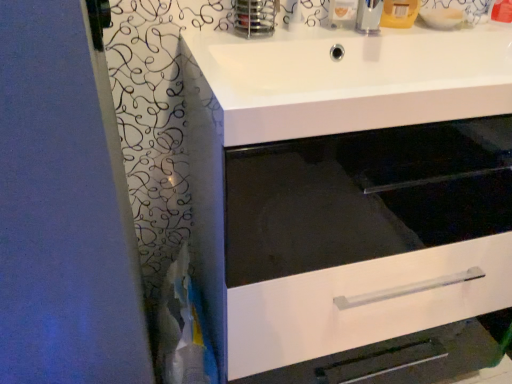
Where is `white glossy sink at upper center`? Image resolution: width=512 pixels, height=384 pixels. white glossy sink at upper center is located at coordinates (347, 79).

This screenshot has height=384, width=512. What do you see at coordinates (347, 79) in the screenshot?
I see `white glossy sink at upper center` at bounding box center [347, 79].

Describe the element at coordinates (351, 200) in the screenshot. The width and height of the screenshot is (512, 384). I see `white glossy drawer at center` at that location.

What is the approximate height of white glossy drawer at center?

white glossy drawer at center is 90.03 centimeters in height.

In the scene shown: In order to face white glossy drawer at center, should I rotate leftwards or rightwards?

To align with it, rotate right about 14.809°.

Locate an element on the screen. The image size is (512, 384). white glossy drawer at center is located at coordinates (351, 200).

Image resolution: width=512 pixels, height=384 pixels. I want to click on white glossy sink at upper center, so pos(347,79).

Looking at this image, based on their positions, is white glossy sink at upper center located to the left or right of white glossy drawer at center?

From the image, it's evident that white glossy sink at upper center is to the right of white glossy drawer at center.

Is white glossy sink at upper center positioned in front of white glossy drawer at center?

That is True.

Does point (201, 74) lie behind point (488, 311)?

No, (201, 74) is in front of (488, 311).

From the image's perspective, who appears lower, white glossy sink at upper center or white glossy drawer at center?

white glossy drawer at center.

From a real-world perspective, is white glossy sink at upper center beneath white glossy drawer at center?

Incorrect, from a real-world perspective, white glossy sink at upper center is higher than white glossy drawer at center.

In terms of width, does white glossy sink at upper center look wider or thinner when compared to white glossy drawer at center?

In the image, white glossy sink at upper center appears to be wider than white glossy drawer at center.

Considering the sizes of white glossy sink at upper center and white glossy drawer at center in the image, is white glossy sink at upper center taller or shorter than white glossy drawer at center?

Clearly, white glossy sink at upper center is shorter compared to white glossy drawer at center.

Considering the sizes of objects white glossy sink at upper center and white glossy drawer at center in the image provided, who is smaller, white glossy sink at upper center or white glossy drawer at center?

With smaller size is white glossy sink at upper center.

Is white glossy sink at upper center positioned beyond the bounds of white glossy drawer at center?

No, white glossy sink at upper center is not outside of white glossy drawer at center.

Does white glossy sink at upper center touch white glossy drawer at center?

No, white glossy sink at upper center is not in contact with white glossy drawer at center.

Is white glossy sink at upper center oriented away from white glossy drawer at center?

No, white glossy sink at upper center is not facing away from white glossy drawer at center.

This screenshot has width=512, height=384. I want to click on sink in front of the white glossy drawer at center, so click(347, 79).

Which is more to the left, white glossy drawer at center or white glossy sink at upper center?

white glossy drawer at center is more to the left.

From the picture: Who is more distant, white glossy drawer at center or white glossy sink at upper center?

white glossy drawer at center is further from the camera.

Does point (395, 51) come behind point (309, 91)?

Yes, point (395, 51) is behind point (309, 91).

From the image's perspective, is white glossy drawer at center located beneath white glossy sink at upper center?

Correct, white glossy drawer at center appears lower than white glossy sink at upper center in the image.

From the picture: From a real-world perspective, who is located higher, white glossy drawer at center or white glossy sink at upper center?

white glossy sink at upper center is physically above.

Is white glossy drawer at center wider or thinner than white glossy sink at upper center?

Considering their sizes, white glossy drawer at center looks slimmer than white glossy sink at upper center.

Is white glossy drawer at center taller than white glossy sink at upper center?

Correct, white glossy drawer at center is much taller as white glossy sink at upper center.

Looking at the image, does white glossy drawer at center seem bigger or smaller compared to white glossy sink at upper center?

Considering their sizes, white glossy drawer at center takes up more space than white glossy sink at upper center.

Is white glossy drawer at center spatially inside white glossy sink at upper center, or outside of it?

The correct answer is: outside.

Is white glossy drawer at center positioned far away from white glossy sink at upper center?

white glossy drawer at center is actually quite close to white glossy sink at upper center.

Is white glossy drawer at center facing towards white glossy sink at upper center?

No, white glossy drawer at center is not oriented towards white glossy sink at upper center.

Can you tell me how much white glossy drawer at center and white glossy sink at upper center differ in facing direction?

The facing directions of white glossy drawer at center and white glossy sink at upper center are 0.157 degrees apart.

The width and height of the screenshot is (512, 384). I want to click on bathroom cabinet located on the left of white glossy sink at upper center, so click(x=351, y=200).

Where is `sink lying above the white glossy drawer at center (from the image's perspective)`? The height and width of the screenshot is (384, 512). sink lying above the white glossy drawer at center (from the image's perspective) is located at coordinates (347, 79).

Identify the location of sink in front of the white glossy drawer at center. The height and width of the screenshot is (384, 512). (347, 79).